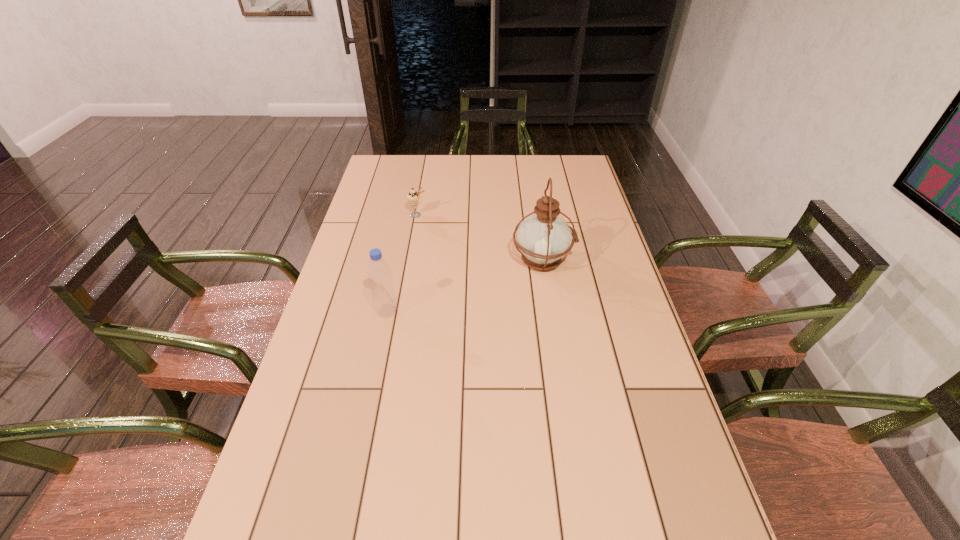
At what (x,y) coordinates should I click in order to perform the action: click on object that is at the right edge. Please return your answer as a coordinate pair (x, y). The height and width of the screenshot is (540, 960). Looking at the image, I should click on (543, 238).

What are the coordinates of `blank space at the far edge of the desktop` in the screenshot? It's located at (474, 179).

Where is `vacant space at the left edge of the desktop`? vacant space at the left edge of the desktop is located at coordinates (396, 234).

In the image, there is a desktop. In order to click on vacant area at the right edge in this screenshot , I will do [596, 360].

In the image, there is a desktop. Where is `vacant area at the far right corner`? This screenshot has height=540, width=960. vacant area at the far right corner is located at coordinates (x=565, y=175).

The image size is (960, 540). What are the coordinates of `empty space that is in between the icecream and the bottle` in the screenshot? It's located at (402, 263).

This screenshot has width=960, height=540. I want to click on free spot between the icecream and the rightmost object, so click(x=480, y=238).

Identify the location of vacant space that's between the second nearest object and the farthest object. This screenshot has width=960, height=540. (480, 238).

Find the location of `empty space that is in between the farthest object and the tallest object`. empty space that is in between the farthest object and the tallest object is located at coordinates (480, 238).

I want to click on the closest object to the second shortest object, so click(543, 238).